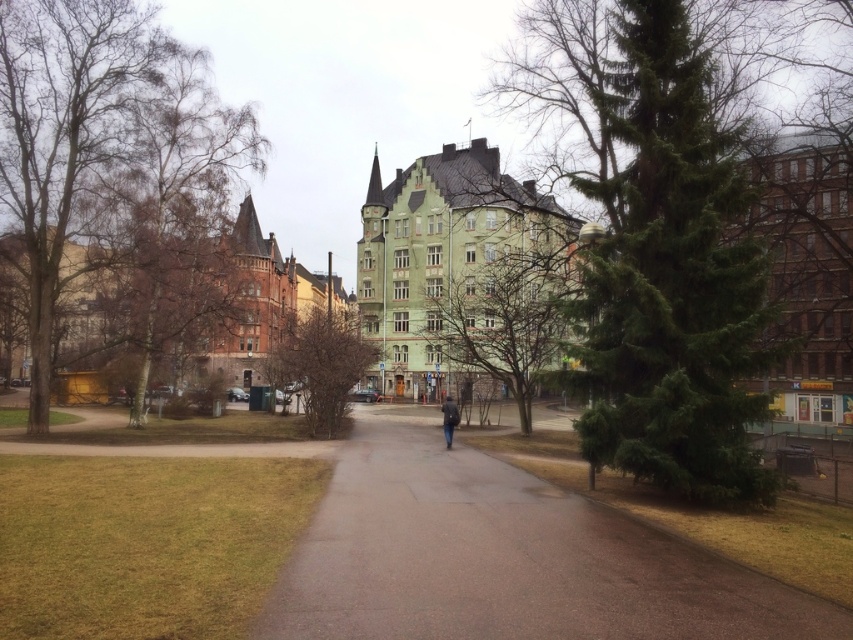
Question: Can you confirm if brown asphalt path at center is thinner than dark gray jacket at center?

Choices:
 (A) no
 (B) yes

Answer: (A)

Question: Does green matte tree at center have a smaller size compared to brown textured bush at center?

Choices:
 (A) yes
 (B) no

Answer: (A)

Question: Among these points, which one is nearest to the camera?

Choices:
 (A) (753, 480)
 (B) (450, 433)
 (C) (78, 60)
 (D) (383, 577)

Answer: (D)

Question: Estimate the real-world distances between objects in this image. Which object is closer to the green matte tree at center?

Choices:
 (A) dark gray jacket at center
 (B) bare birch tree at left

Answer: (A)

Question: Is green textured tree at center below bare birch tree at left?

Choices:
 (A) no
 (B) yes

Answer: (B)

Question: Based on their relative distances, which object is nearer to the green matte tree at center?

Choices:
 (A) green textured tree at center
 (B) bare birch tree at left
 (C) brown asphalt path at center
 (D) brown textured bush at center

Answer: (A)